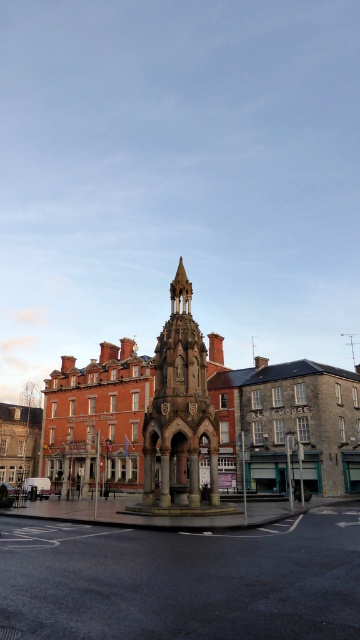
You are standing at the intersection of two streets and see the stone fountain at center. If you walk directly towards the fountain, will you be facing north, south, east, or west?

The question cannot be answered with the provided information.

You are standing at the corner of the street where the historical stone structure is located. You notice the stone fountain at center and the stone carved bell tower at center. Which one has a greater height?

The stone carved bell tower at center is taller than the stone fountain at center.

You are a tourist standing in front of the historical stone structure. You notice the stone fountain at center and the stone carved bell tower at center. Which one is positioned to the left?

The stone fountain at center is to the left of the stone carved bell tower at center, so the stone fountain at center is positioned to the left.